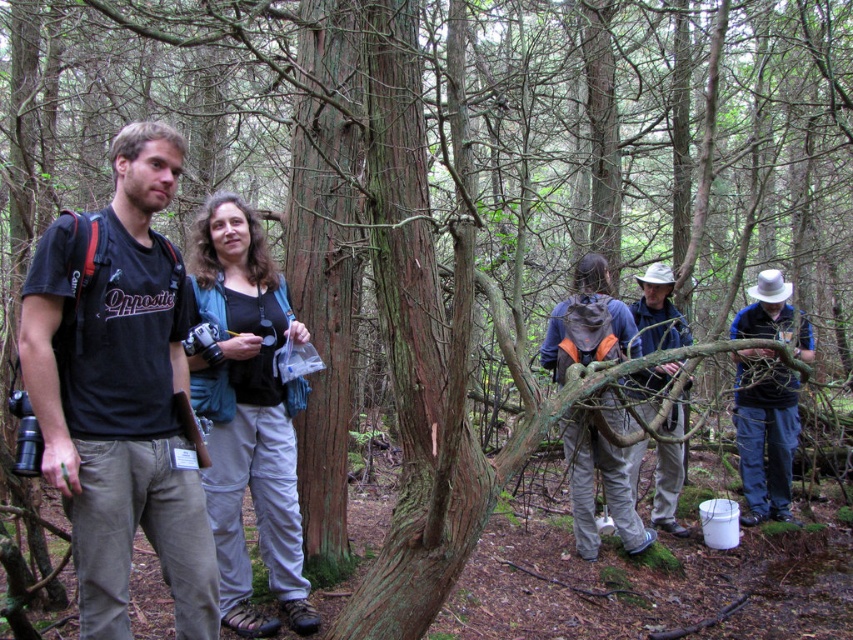
You are standing in the forest and see the point at coordinates (x=120, y=394). Which object is this point located on?

The point at coordinates (x=120, y=394) is located on the matte black t shirt at left.

You are standing in the forest and see a point marked at coordinates (x=241, y=500). If you want to place a 10 feet long rope from your current position to that point, will the rope be sufficient?

The point at coordinates (x=241, y=500) is 13.12 feet away from the viewer. Since the rope is only 10 feet long, it will not be sufficient to reach that point.